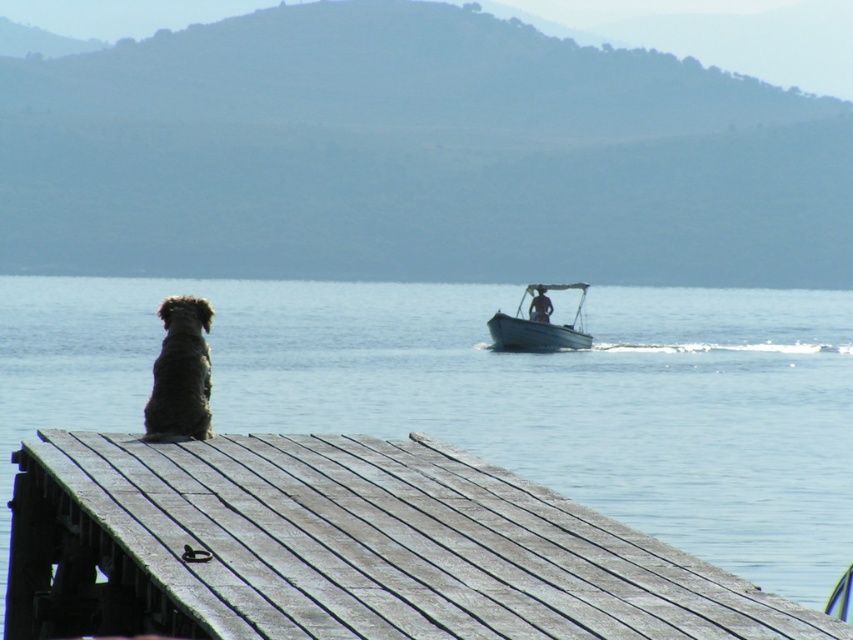
Question: Among these objects, which one is nearest to the camera?

Choices:
 (A) fuzzy brown dog at left
 (B) white plastic boat at center

Answer: (A)

Question: From the image, what is the correct spatial relationship of weathered wood dock at lower left in relation to fuzzy brown dog at left?

Choices:
 (A) left
 (B) right

Answer: (B)

Question: Can you confirm if weathered wood dock at lower left is wider than white plastic boat at center?

Choices:
 (A) yes
 (B) no

Answer: (B)

Question: Considering the real-world distances, which object is closest to the fuzzy brown dog at left?

Choices:
 (A) white plastic boat at center
 (B) weathered wood dock at lower left

Answer: (B)

Question: Among these objects, which one is nearest to the camera?

Choices:
 (A) fuzzy brown dog at left
 (B) weathered wood dock at lower left
 (C) white plastic boat at center

Answer: (B)

Question: Is weathered wood dock at lower left to the left of white plastic boat at center from the viewer's perspective?

Choices:
 (A) yes
 (B) no

Answer: (A)